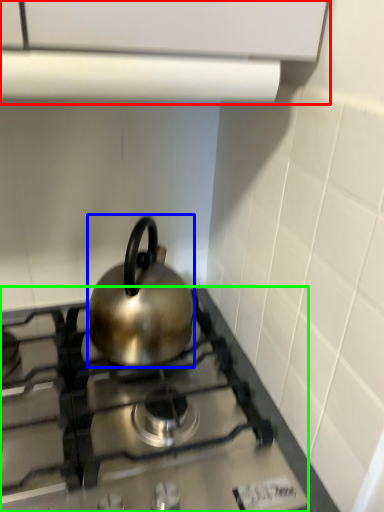
Question: Which is farther away from vent (highlighted by a red box)? kettle (highlighted by a blue box) or gas stove (highlighted by a green box)?

Choices:
 (A) kettle
 (B) gas stove

Answer: (B)